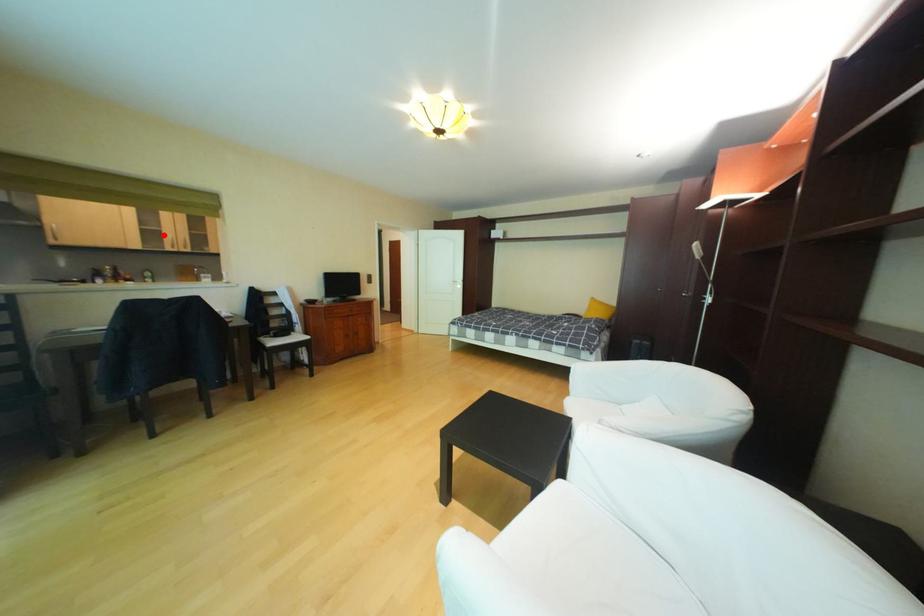
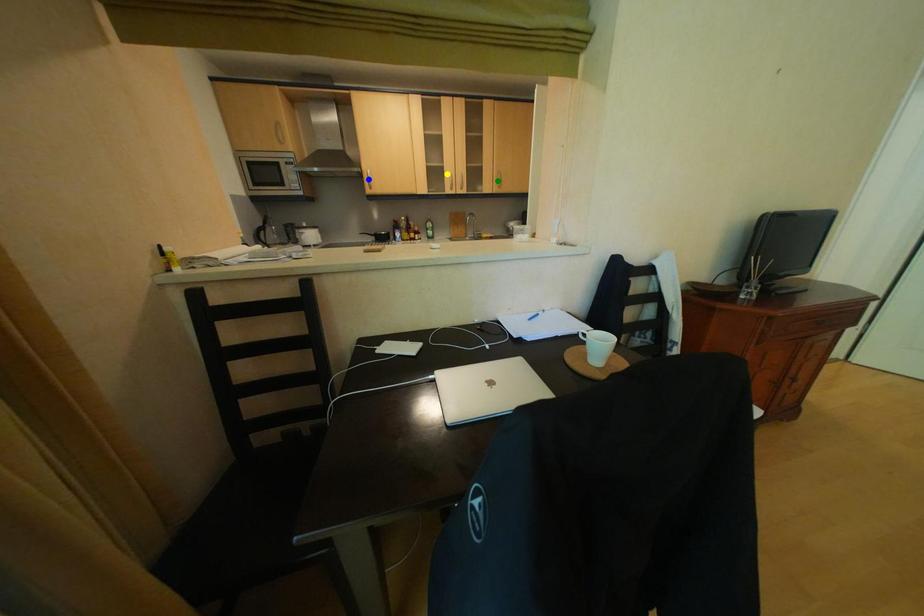
Question: I am providing you with two images of the same scene from different viewpoints. A red point is marked on the first image. You are given multiple points on the second image. Which mark in image 2 goes with the point in image 1?

Choices:
 (A) yellow point
 (B) green point
 (C) blue point

Answer: (A)